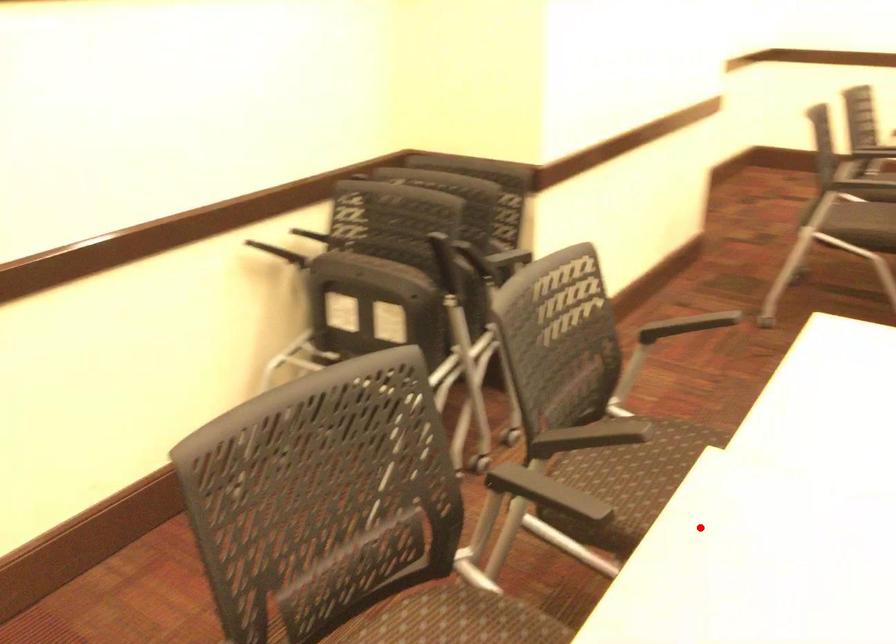
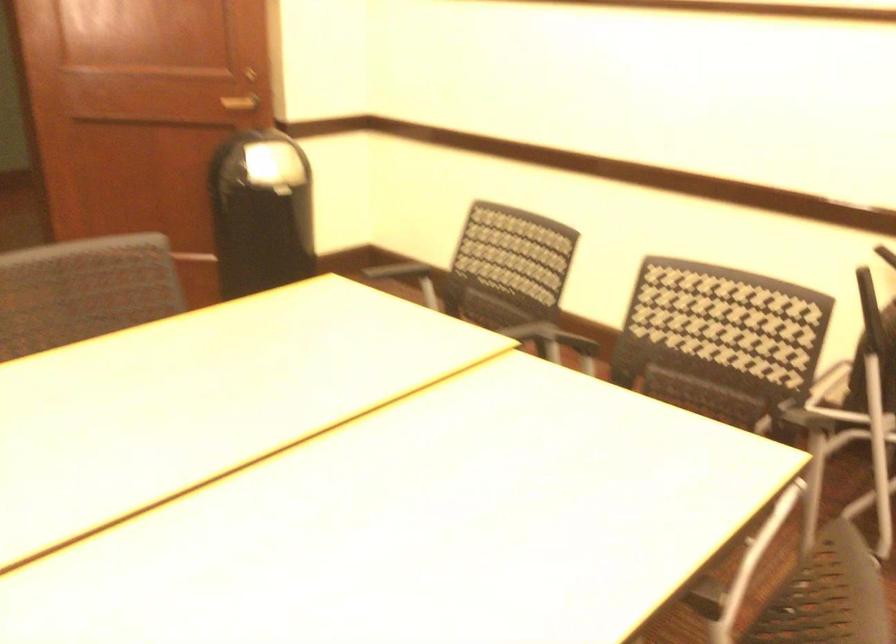
In the second image, find the point that corresponds to the highlighted location in the first image.

(446, 332)